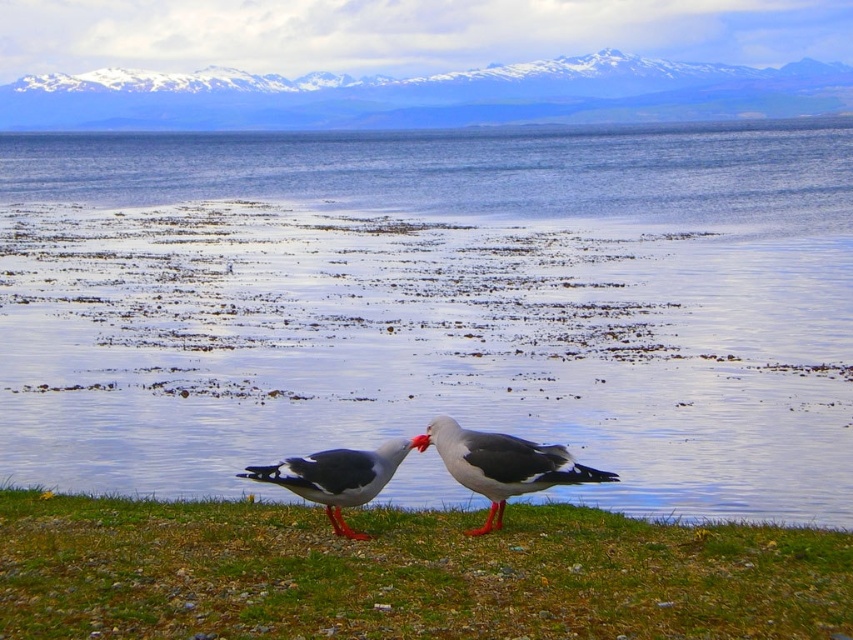
You are a photographer trying to capture a landscape shot of the snowy mountain range at upper center. You notice the green grass at lower center is blocking your view. Can you determine if the grass is between you and the mountain range?

The green grass at lower center is positioned under snowy mountain range at upper center, so yes, the grass is between you and the mountain range.

Based on the photo, you are standing at the point with coordinates (503, 465) in the coastal scene. What object is exactly at your current location?

The gray matte seagull at center is located at point (503, 465).